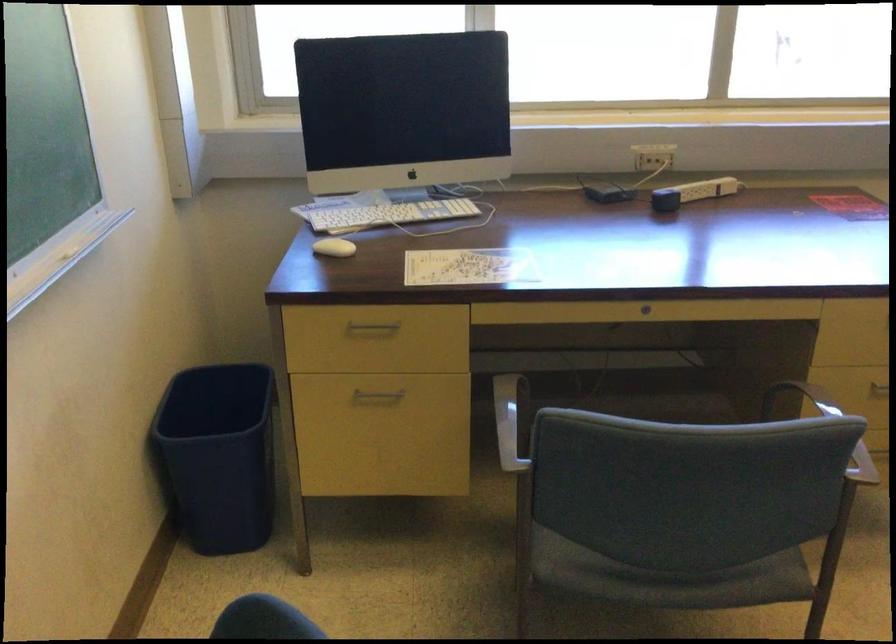
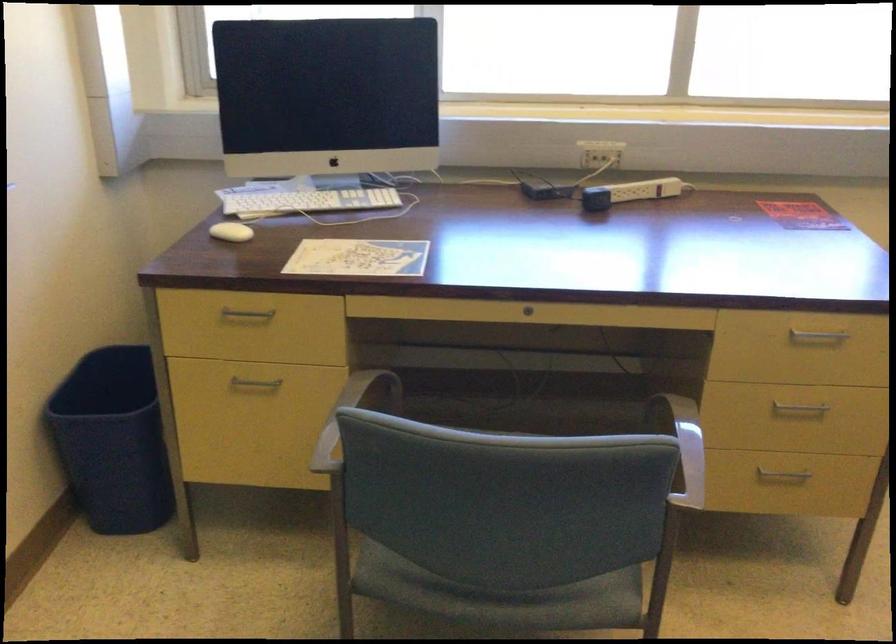
Find the pixel in the second image that matches the point at 331,245 in the first image.

(230, 232)